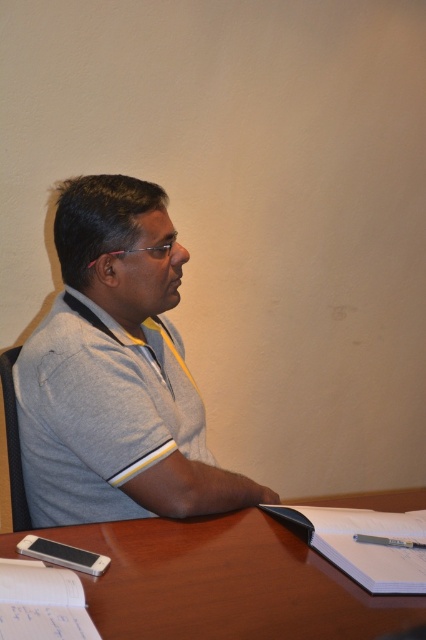
Question: Is gray cotton shirt at center positioned before white paper at lower right?

Choices:
 (A) no
 (B) yes

Answer: (A)

Question: Estimate the real-world distances between objects in this image. Which object is farther from the gray cotton shirt at center?

Choices:
 (A) metallic pen at lower center
 (B) brown wooden table at center

Answer: (A)

Question: Does brown wooden table at center have a larger size compared to metallic pen at lower center?

Choices:
 (A) no
 (B) yes

Answer: (B)

Question: Which is farther from the brown wooden table at center?

Choices:
 (A) white paper at lower right
 (B) metallic pen at lower center

Answer: (B)

Question: Considering the relative positions of white paper at lower right and metallic pen at lower center in the image provided, where is white paper at lower right located with respect to metallic pen at lower center?

Choices:
 (A) below
 (B) above

Answer: (A)

Question: Which point is closer to the camera taking this photo?

Choices:
 (A) (360, 540)
 (B) (328, 532)

Answer: (A)